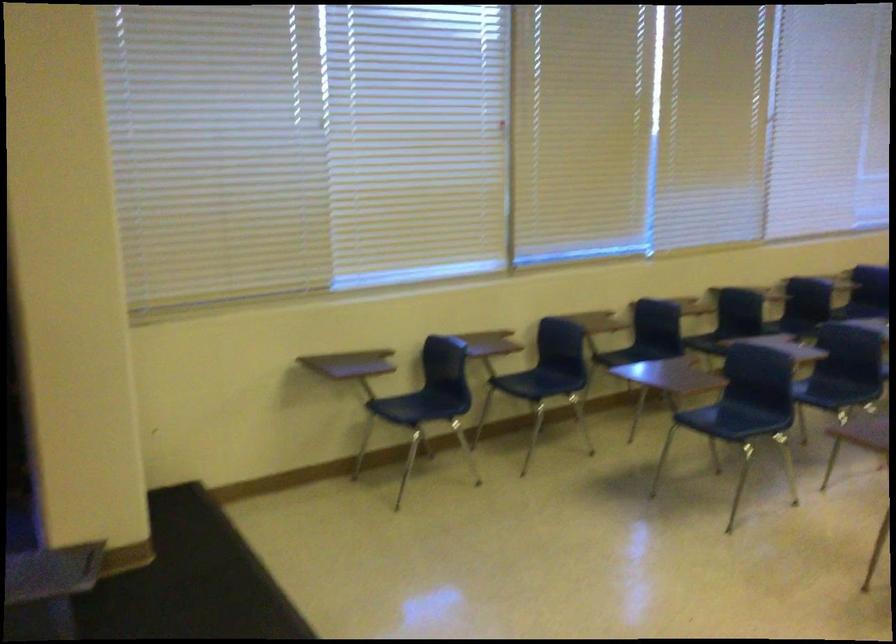
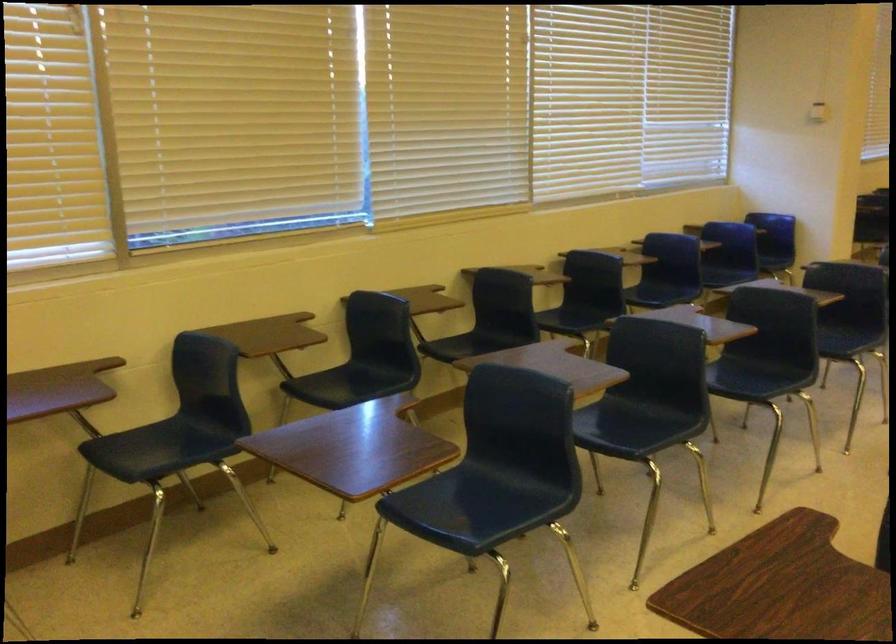
In a continuous first-person perspective shot, in which direction is the camera moving?

The cameraman walked toward right, forward.